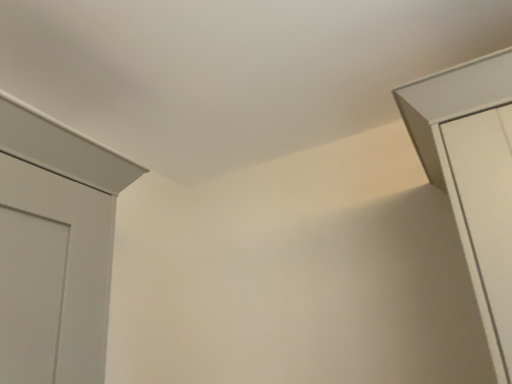
Identify the location of white matte door at left. This screenshot has width=512, height=384. [x=55, y=276].

This screenshot has height=384, width=512. What do you see at coordinates (55, 276) in the screenshot? I see `white matte door at left` at bounding box center [55, 276].

You are a GUI agent. You are given a task and a screenshot of the screen. Output one action in this format:
    pyautogui.click(x=<x>, y=<y>)
    Task: Click on the white matte door at left
    The image size is (512, 384).
    Given the screenshot: What is the action you would take?
    pyautogui.click(x=55, y=276)